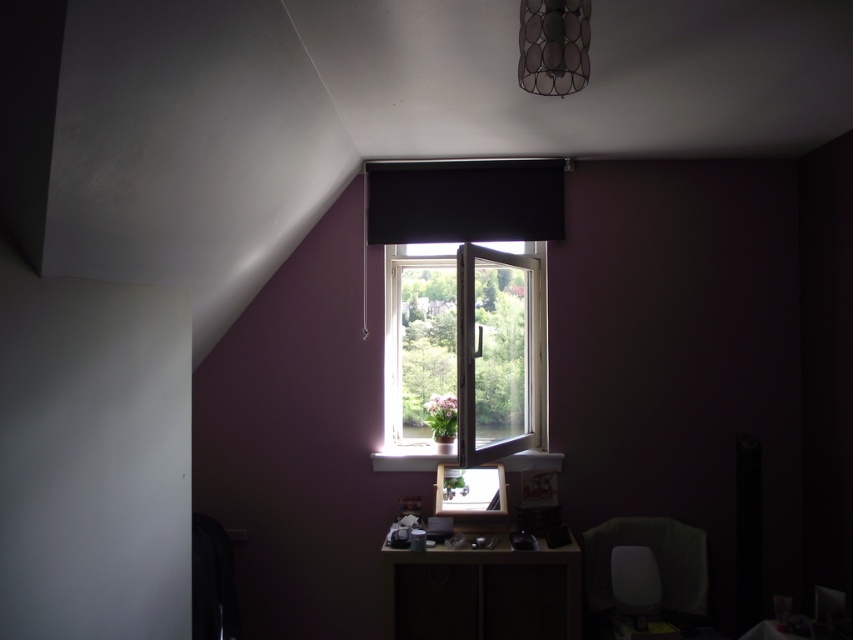
You are an interior designer planning to replace the black matte curtain at upper center and the metallic wire mesh lampshade at upper center with new ones. If you want to maintain the current width ratio between them, which object should you prioritize in terms of width when choosing the new items?

The black matte curtain at upper center should be prioritized as it is wider than the metallic wire mesh lampshade at upper center, so maintaining their width ratio requires adjusting the new curtain and lampshade accordingly.

You are a delivery person trying to place a package on the desk between the white plastic window at center and the velvet green chair at lower right. The package is 90 centimeters long. Will it fit horizontally between them?

The distance between the white plastic window at center and the velvet green chair at lower right is 87.66 centimeters. Since the package is 90 centimeters long, it is 2.34 centimeters too long to fit horizontally between them.

You are standing in the cozy interior space with a deep purple wall. You need to place a small potted plant with vibrant pink flowers on the windowsill. Where exactly should you place it so that it aligns with the white plastic window at center?

The white plastic window at center is located at point (463, 353), so you should place the potted plant with vibrant pink flowers on the windowsill at that coordinate to align with it.